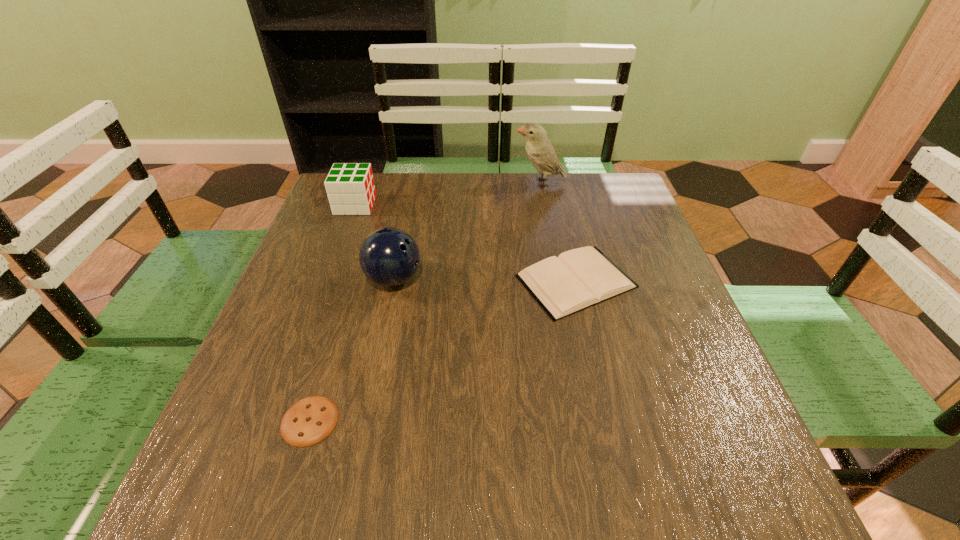
The height and width of the screenshot is (540, 960). What are the coordinates of `the farthest object` in the screenshot? It's located at (539, 149).

Image resolution: width=960 pixels, height=540 pixels. Identify the location of the tallest object. (539, 149).

At what (x,y) coordinates should I click in order to perform the action: click on bowling ball. Please return your answer as a coordinate pair (x, y). Image resolution: width=960 pixels, height=540 pixels. Looking at the image, I should click on (389, 257).

The height and width of the screenshot is (540, 960). Identify the location of cube. (350, 187).

The image size is (960, 540). Find the location of `the fourth nearest object`. the fourth nearest object is located at coordinates (350, 187).

This screenshot has width=960, height=540. Identify the location of the second shortest object. (579, 278).

Image resolution: width=960 pixels, height=540 pixels. I want to click on the shortest object, so click(310, 420).

Image resolution: width=960 pixels, height=540 pixels. I want to click on the nearest object, so click(x=310, y=420).

Find the location of a particular element. The height and width of the screenshot is (540, 960). blank area located 0.180m at the face of the tallest object is located at coordinates (452, 183).

Identify the location of vacant space located at the face of the tallest object. The image size is (960, 540). (486, 183).